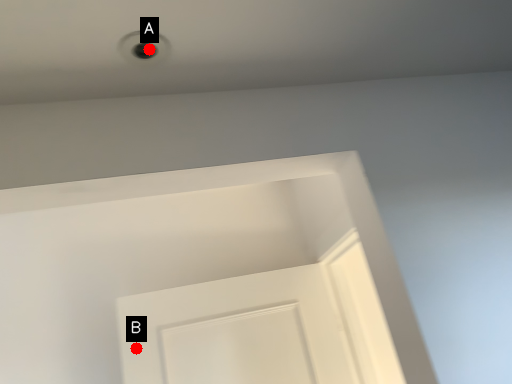
Question: Two points are circled on the image, labeled by A and B beside each circle. Which point is closer to the camera taking this photo?

Choices:
 (A) A is closer
 (B) B is closer

Answer: (A)